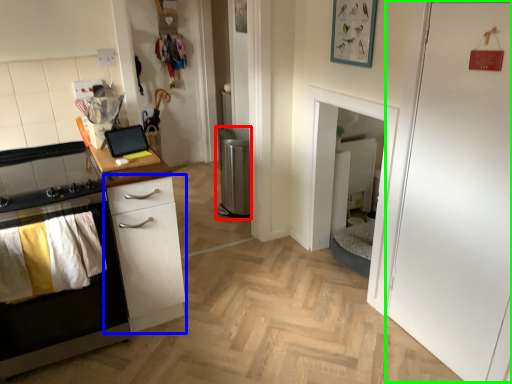
Question: Which object is the farthest from appliance (highlighted by a red box)? Choose among these: chest of drawers (highlighted by a blue box) or door (highlighted by a green box).

Choices:
 (A) chest of drawers
 (B) door

Answer: (B)